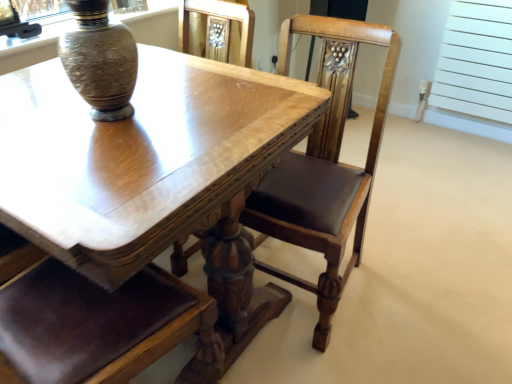
Question: Is speckled ceramic vase at upper left inside or outside of shiny wood table at center?

Choices:
 (A) outside
 (B) inside

Answer: (A)

Question: In terms of size, does speckled ceramic vase at upper left appear bigger or smaller than shiny wood table at center?

Choices:
 (A) small
 (B) big

Answer: (A)

Question: Estimate the real-world distances between objects in this image. Which object is farther from the white matte radiator at upper right?

Choices:
 (A) speckled ceramic vase at upper left
 (B) polished wood chair at center
 (C) shiny wood table at center

Answer: (A)

Question: Estimate the real-world distances between objects in this image. Which object is farther from the polished wood chair at center?

Choices:
 (A) speckled ceramic vase at upper left
 (B) white matte radiator at upper right
 (C) shiny wood table at center

Answer: (B)